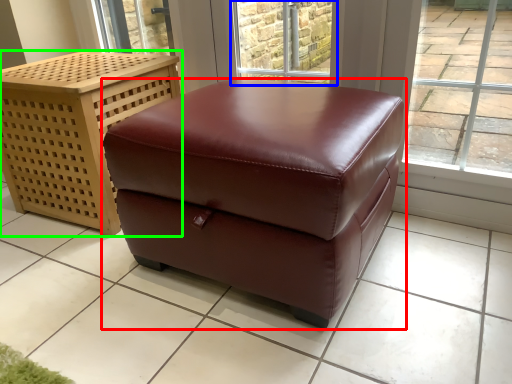
Question: Which object is the closest to the table (highlighted by a red box)? Choose among these: window (highlighted by a blue box) or furniture (highlighted by a green box).

Choices:
 (A) window
 (B) furniture

Answer: (B)